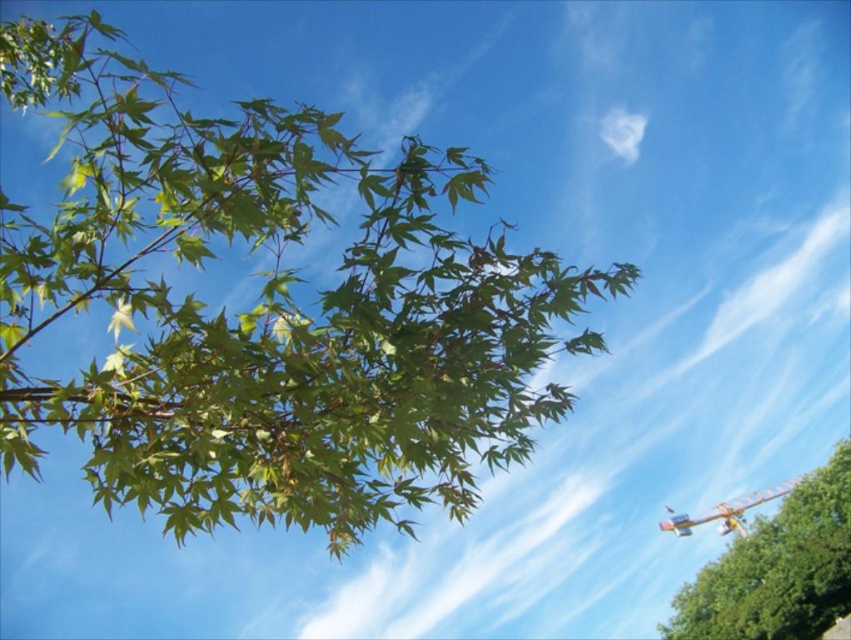
Question: Which object appears farthest from the camera in this image?

Choices:
 (A) green matte tree at upper left
 (B) green matte leaves at upper left

Answer: (A)

Question: Is green matte tree at upper left to the left of yellow metallic biplane at lower right from the viewer's perspective?

Choices:
 (A) yes
 (B) no

Answer: (A)

Question: Does green matte leaves at upper left have a greater width compared to green matte tree at upper left?

Choices:
 (A) yes
 (B) no

Answer: (B)

Question: Does green matte leaves at upper left appear over green matte tree at upper left?

Choices:
 (A) yes
 (B) no

Answer: (A)

Question: Based on their relative distances, which object is nearer to the green matte leaves at upper left?

Choices:
 (A) yellow metallic biplane at lower right
 (B) green matte tree at upper left

Answer: (B)

Question: Which object appears farthest from the camera in this image?

Choices:
 (A) yellow metallic biplane at lower right
 (B) green matte tree at upper left

Answer: (A)